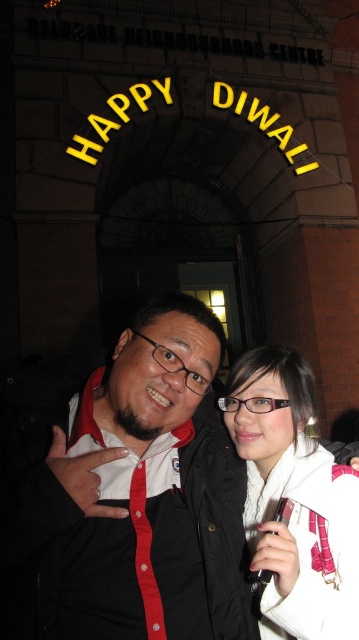
Is matte black shirt at center shorter than white soft scarf at center?

Correct, matte black shirt at center is not as tall as white soft scarf at center.

Between point (42, 616) and point (291, 451), which one is positioned in front?

Positioned in front is point (42, 616).

Who is more distant from viewer, (173, 554) or (309, 604)?

The point (173, 554) is behind.

The width and height of the screenshot is (359, 640). Find the location of `matte black shirt at center`. matte black shirt at center is located at coordinates (128, 492).